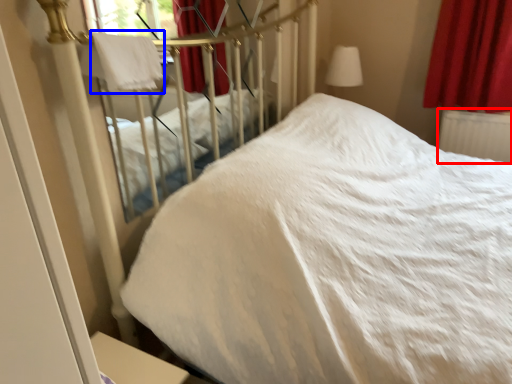
Question: Which point is further to the camera, radiator (highlighted by a red box) or blanket (highlighted by a blue box)?

Choices:
 (A) radiator
 (B) blanket

Answer: (A)